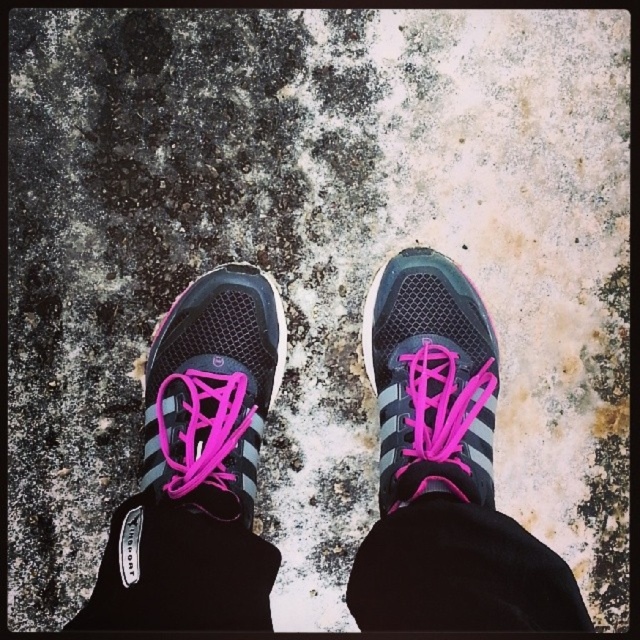
Question: Can you confirm if matte black sneakers at center is smaller than matte black shoe at center?

Choices:
 (A) yes
 (B) no

Answer: (B)

Question: Does matte black sneakers at center have a greater width compared to matte black shoe at center?

Choices:
 (A) no
 (B) yes

Answer: (B)

Question: Estimate the real-world distances between objects in this image. Which object is farther from the matte black shoe at center?

Choices:
 (A) matte black sneakers at center
 (B) matte black sneaker at center

Answer: (B)

Question: Is matte black sneaker at center further to camera compared to matte black shoe at center?

Choices:
 (A) yes
 (B) no

Answer: (A)

Question: Considering the real-world distances, which object is farthest from the matte black shoe at center?

Choices:
 (A) matte black sneaker at center
 (B) matte black sneakers at center

Answer: (A)

Question: Considering the real-world distances, which object is closest to the matte black sneaker at center?

Choices:
 (A) matte black shoe at center
 (B) matte black sneakers at center

Answer: (B)